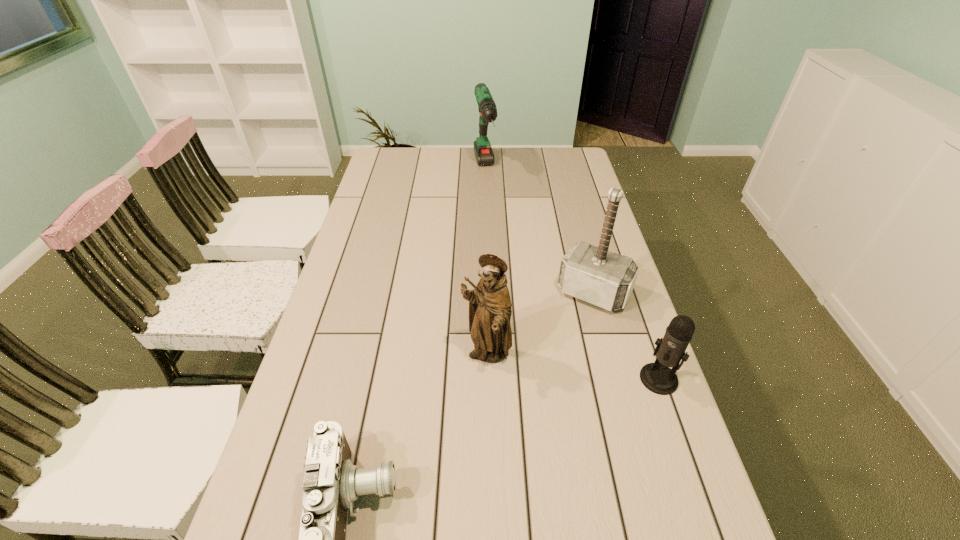
I want to click on vacant space located 0.230m on the handle side of the farthest object, so click(x=495, y=226).

Locate an element on the screen. The image size is (960, 540). free region located 0.080m on the front-facing side of the figurine is located at coordinates (484, 404).

At what (x,y) coordinates should I click in order to perform the action: click on vacant space situated on the front-facing side of the figurine. Please return your answer as a coordinate pair (x, y). Looking at the image, I should click on (480, 462).

The height and width of the screenshot is (540, 960). Find the location of `vacant area situated on the front-facing side of the figurine`. vacant area situated on the front-facing side of the figurine is located at coordinates (480, 462).

Find the location of `object that is at the far edge`. object that is at the far edge is located at coordinates (483, 151).

At what (x,y) coordinates should I click in order to perform the action: click on microphone that is positioned at the right edge. Please return your answer as a coordinate pair (x, y). The width and height of the screenshot is (960, 540). Looking at the image, I should click on (657, 377).

Locate an element on the screen. The width and height of the screenshot is (960, 540). hammer located at the right edge is located at coordinates (593, 274).

In the image, there is a desktop. In order to click on vacant space at the left edge in this screenshot , I will do `click(377, 269)`.

The image size is (960, 540). Identify the location of vacant space at the right edge of the desktop. (569, 199).

In the image, there is a desktop. Where is `vacant space at the far left corner`? The width and height of the screenshot is (960, 540). vacant space at the far left corner is located at coordinates coord(395,156).